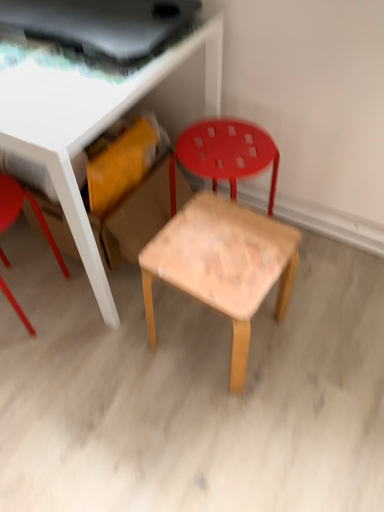
The height and width of the screenshot is (512, 384). Identify the location of free space above wooden chair at center, which is the 1th chair in right-to-left order (from a real-world perspective). (219, 145).